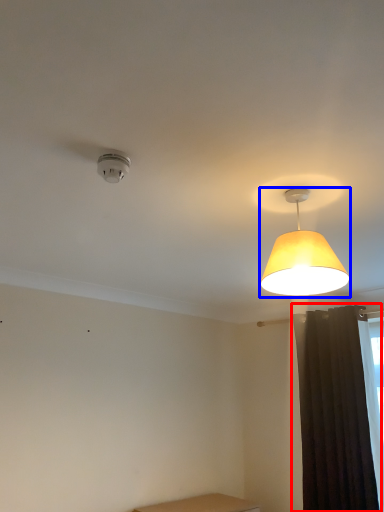
Question: Which point is closer to the camera, curtain (highlighted by a red box) or lamp (highlighted by a blue box)?

Choices:
 (A) curtain
 (B) lamp

Answer: (B)